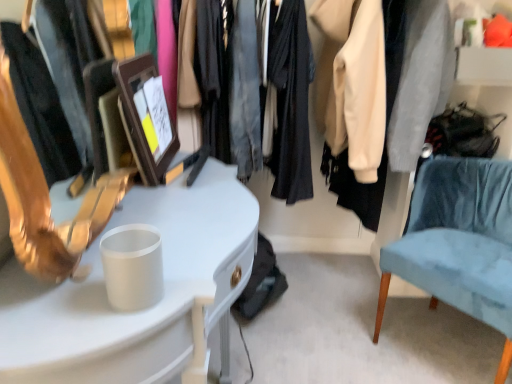
Question: From a real-world perspective, is white glossy desk at left positioned over velvet blue chair at right based on gravity?

Choices:
 (A) yes
 (B) no

Answer: (A)

Question: Is white glossy desk at left at the right side of velvet blue chair at right?

Choices:
 (A) yes
 (B) no

Answer: (B)

Question: Is white glossy desk at left beside velvet blue chair at right?

Choices:
 (A) yes
 (B) no

Answer: (B)

Question: Would you say white glossy desk at left is a long distance from velvet blue chair at right?

Choices:
 (A) yes
 (B) no

Answer: (B)

Question: Can you confirm if white glossy desk at left is smaller than velvet blue chair at right?

Choices:
 (A) yes
 (B) no

Answer: (B)

Question: From the image's perspective, is white glossy desk at left on top of velvet blue chair at right?

Choices:
 (A) yes
 (B) no

Answer: (B)

Question: Does velvet blue chair at right have a lesser height compared to white glossy desk at left?

Choices:
 (A) no
 (B) yes

Answer: (B)

Question: Considering the relative positions of velvet blue chair at right and white glossy desk at left in the image provided, is velvet blue chair at right to the right of white glossy desk at left from the viewer's perspective?

Choices:
 (A) no
 (B) yes

Answer: (B)

Question: Is white glossy desk at left completely or partially inside velvet blue chair at right?

Choices:
 (A) no
 (B) yes

Answer: (A)

Question: From the image's perspective, would you say velvet blue chair at right is shown under white glossy desk at left?

Choices:
 (A) no
 (B) yes

Answer: (A)

Question: Is the depth of velvet blue chair at right less than that of white glossy desk at left?

Choices:
 (A) no
 (B) yes

Answer: (A)

Question: Would you say velvet blue chair at right is outside white glossy desk at left?

Choices:
 (A) yes
 (B) no

Answer: (A)

Question: In the image, is white glossy desk at left positioned in front of or behind velvet blue chair at right?

Choices:
 (A) front
 (B) behind

Answer: (A)